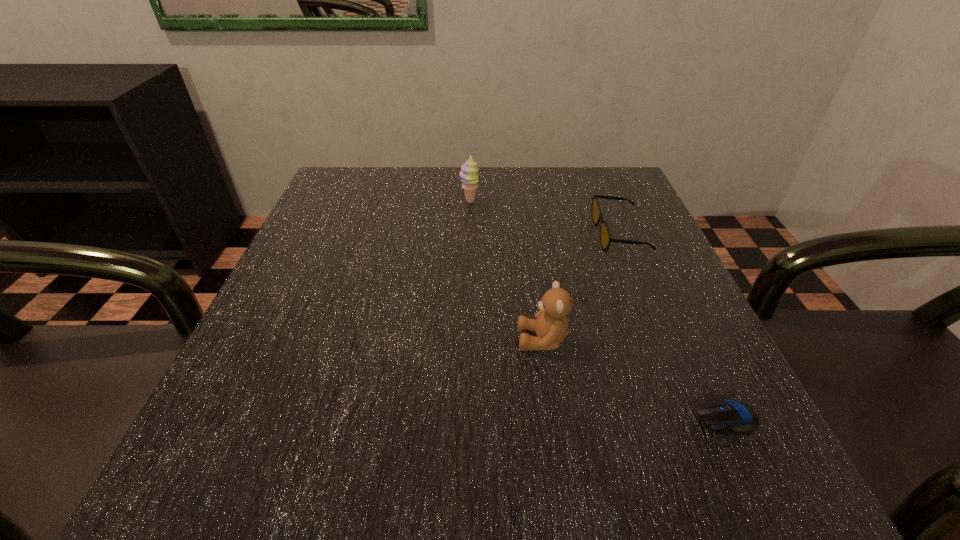
Locate an element on the screen. vacant space at the far right corner of the desktop is located at coordinates (613, 200).

Identify the location of unoccupied position between the leftmost object and the computer mouse. The image size is (960, 540). (598, 309).

Locate an element on the screen. Image resolution: width=960 pixels, height=540 pixels. vacant space in between the teddy bear and the sunglasses is located at coordinates click(x=581, y=287).

I want to click on vacant space in between the computer mouse and the sunglasses, so click(673, 326).

Identify the location of vacant area that lies between the second object from left to right and the shortest object. The image size is (960, 540). (635, 378).

This screenshot has height=540, width=960. I want to click on free space between the computer mouse and the second nearest object, so click(x=635, y=378).

Where is `vacant area that lies between the third nearest object and the teddy bear`? The width and height of the screenshot is (960, 540). vacant area that lies between the third nearest object and the teddy bear is located at coordinates (581, 287).

Where is `vacant area between the teddy bear and the computer mouse`? vacant area between the teddy bear and the computer mouse is located at coordinates tap(635, 378).

Locate an element on the screen. This screenshot has height=540, width=960. empty space that is in between the second farthest object and the sherbert is located at coordinates (544, 219).

The image size is (960, 540). Identify the location of empty space between the second shortest object and the shortest object. (673, 326).